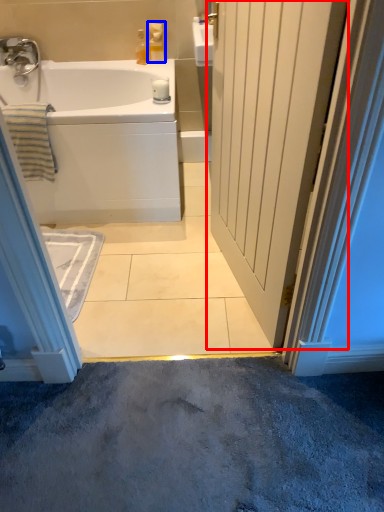
Question: Which point is closer to the camera, door (highlighted by a red box) or toiletry (highlighted by a blue box)?

Choices:
 (A) door
 (B) toiletry

Answer: (A)